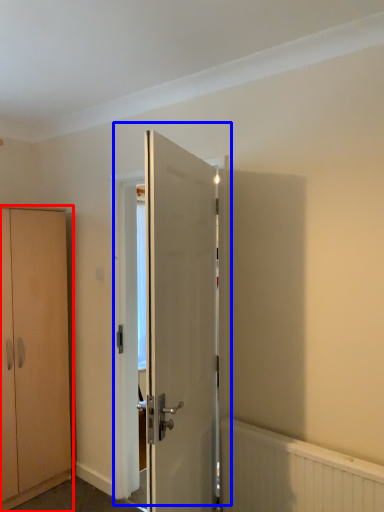
Question: Which point is closer to the camera, cabinetry (highlighted by a red box) or door (highlighted by a blue box)?

Choices:
 (A) cabinetry
 (B) door

Answer: (B)